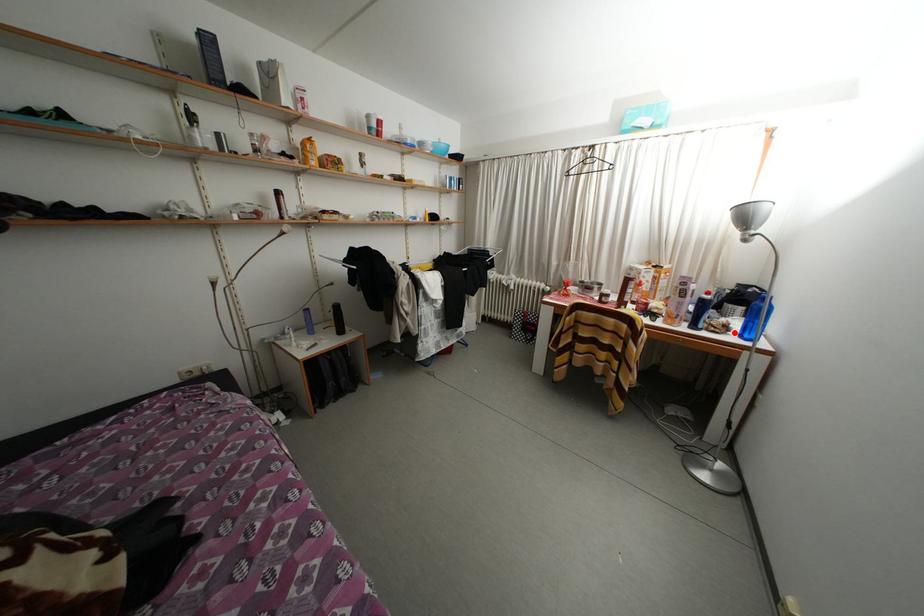
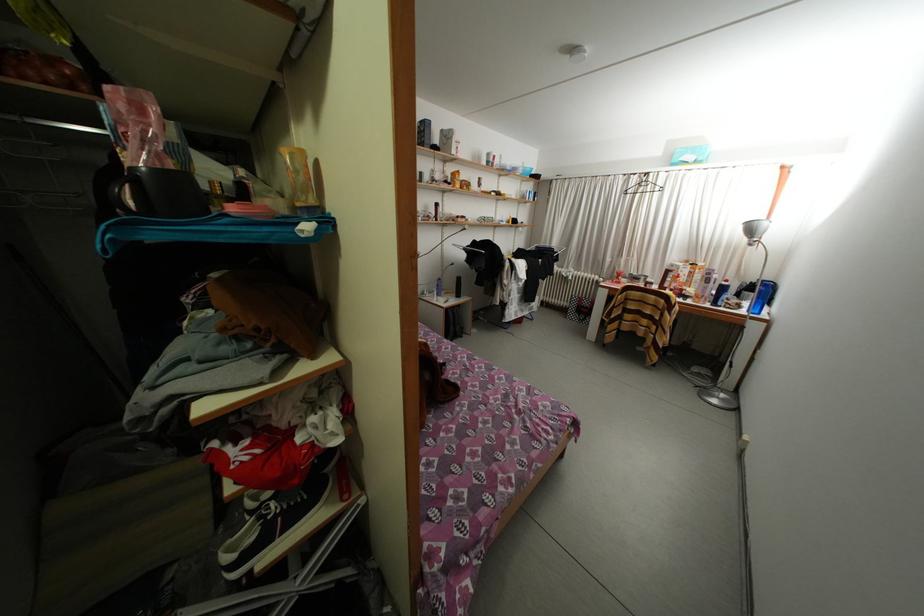
Find the pixel in the second image that matches the highlighted location in the first image.

(747, 310)